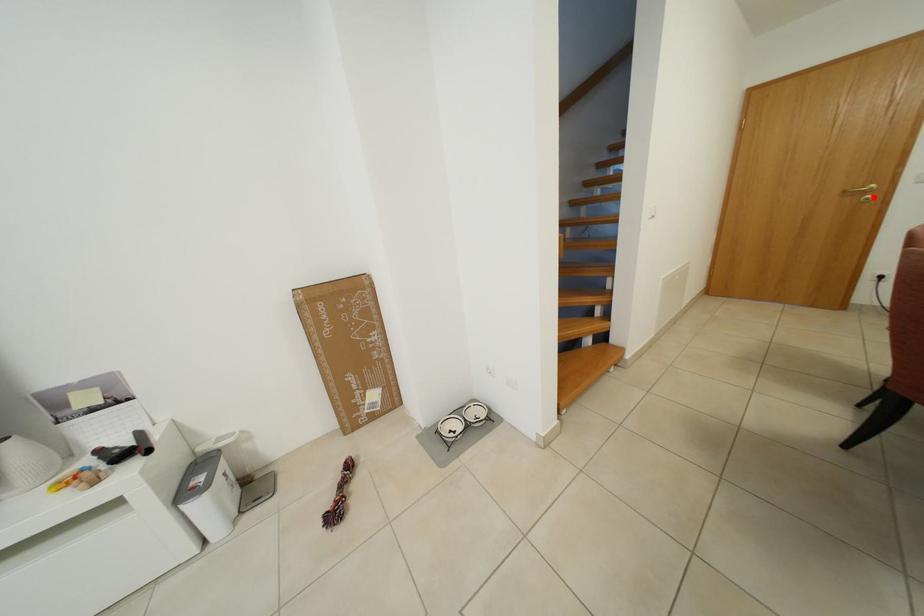
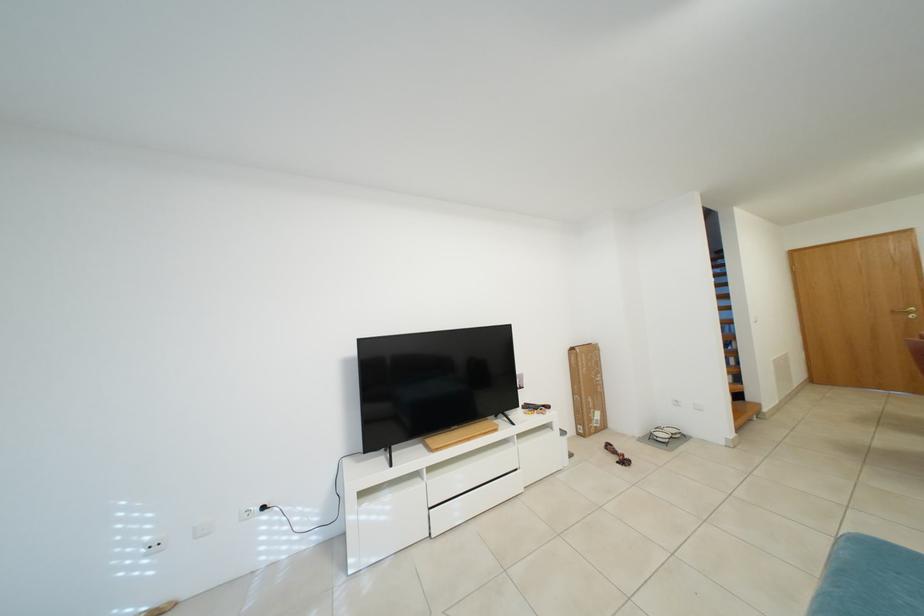
Question: I am providing you with two images of the same scene from different viewpoints. A red point is marked on the first image. Can you still see the location of the red point in image 2?

Choices:
 (A) Yes
 (B) No

Answer: (A)